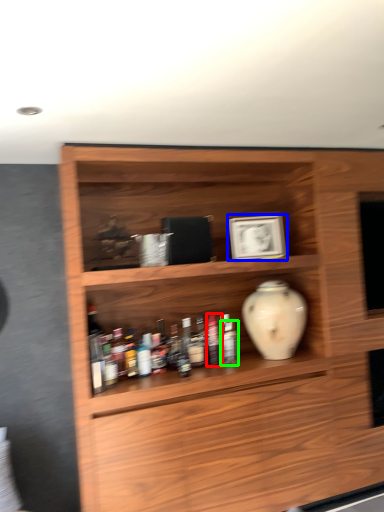
Question: Estimate the real-world distances between objects in this image. Which object is closer to bottle (highlighted by a red box), picture frame (highlighted by a blue box) or bottle (highlighted by a green box)?

Choices:
 (A) picture frame
 (B) bottle

Answer: (B)